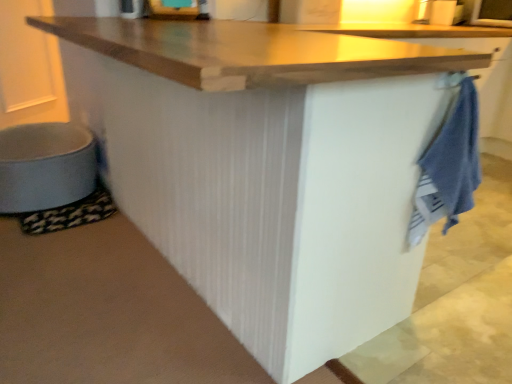
Question: Considering the positions of blue cotton towel at right and matte gray step stool at lower left in the image, is blue cotton towel at right wider or thinner than matte gray step stool at lower left?

Choices:
 (A) thin
 (B) wide

Answer: (A)

Question: Based on their positions, is blue cotton towel at right located to the left or right of matte gray step stool at lower left?

Choices:
 (A) left
 (B) right

Answer: (B)

Question: Is blue cotton towel at right situated inside matte gray step stool at lower left or outside?

Choices:
 (A) outside
 (B) inside

Answer: (A)

Question: From the image's perspective, relative to blue cotton towel at right, is matte gray step stool at lower left above or below?

Choices:
 (A) below
 (B) above

Answer: (B)

Question: Is matte gray step stool at lower left bigger or smaller than blue cotton towel at right?

Choices:
 (A) big
 (B) small

Answer: (A)

Question: Is matte gray step stool at lower left in front of or behind blue cotton towel at right in the image?

Choices:
 (A) front
 (B) behind

Answer: (B)

Question: Is matte gray step stool at lower left spatially inside blue cotton towel at right, or outside of it?

Choices:
 (A) outside
 (B) inside

Answer: (A)